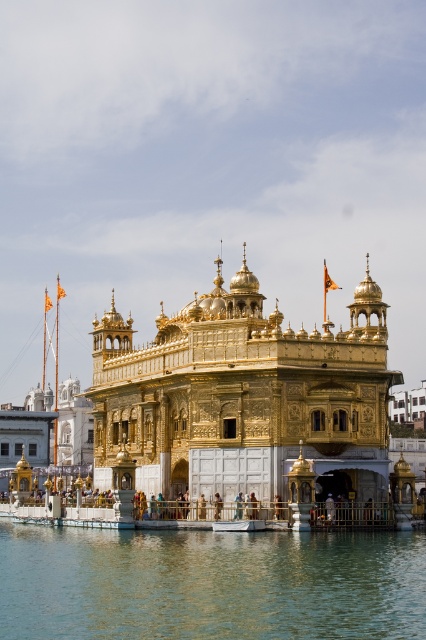
Which is above, gold/gilded temple at center or blue fabric person at center?

gold/gilded temple at center is higher up.

Does point (152, 403) come closer to viewer compared to point (235, 497)?

No, it is behind (235, 497).

Is point (264, 483) positioned after point (238, 500)?

Yes.

The image size is (426, 640). What are the coordinates of `gold/gilded temple at center` in the screenshot? It's located at (244, 396).

Which is behind, point (262, 579) or point (216, 518)?

Point (216, 518)

Is point (328, 611) closer to camera compared to point (213, 516)?

Yes, point (328, 611) is in front of point (213, 516).

The width and height of the screenshot is (426, 640). Find the location of `clear water at lower center`. clear water at lower center is located at coordinates (210, 584).

Is clear water at lower center below blue fabric person at center?

Correct, clear water at lower center is located below blue fabric person at center.

Who is more forward, (11, 634) or (235, 509)?

Point (11, 634)

You are a GUI agent. You are given a task and a screenshot of the screen. Output one action in this format:
    pyautogui.click(x=<x>, y=<y>)
    Task: Click on the clear water at lower center
    The image size is (426, 640).
    Given the screenshot: What is the action you would take?
    pyautogui.click(x=210, y=584)